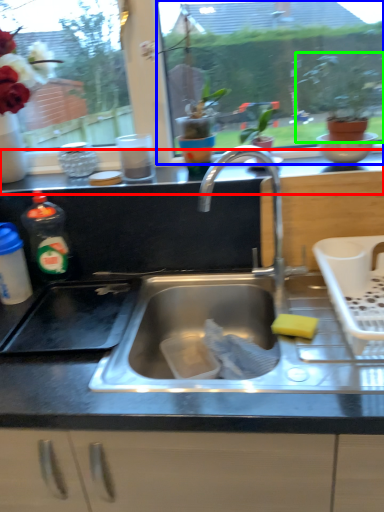
Question: Which object is positioned closest to counter top (highlighted by a red box)? Select from window screen (highlighted by a blue box) and houseplant (highlighted by a green box).

Choices:
 (A) window screen
 (B) houseplant

Answer: (B)